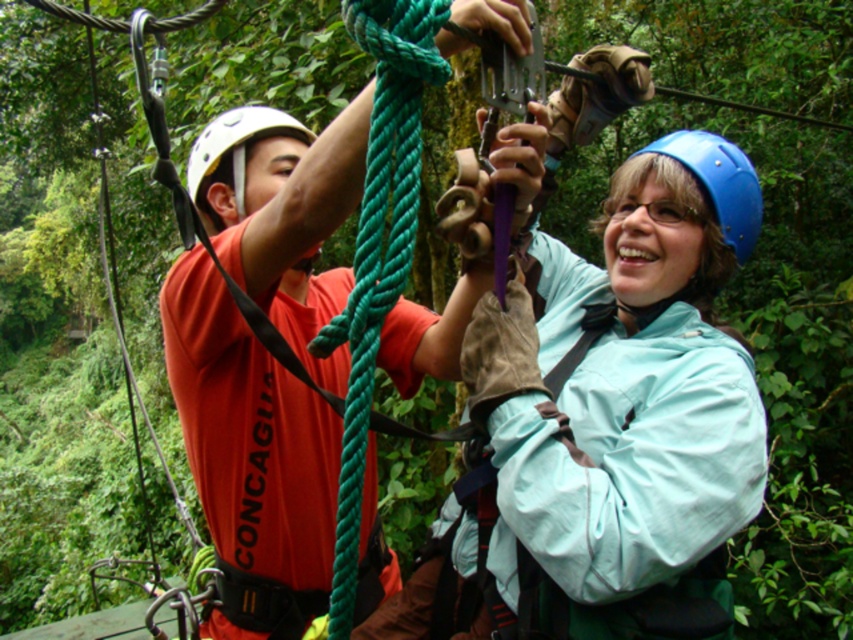
You are a safety inspector observing the ropes course activity. You notice two helmets in the scene. Which helmet, the blue matte helmet at center or the white matte helmet at upper left, is positioned closer to you?

The blue matte helmet at center is closer to the viewer than the white matte helmet at upper left.

You are a safety inspector checking the equipment of two participants in a ropes course. You notice the blue matte helmet at center and the white matte helmet at upper left. According to safety regulations, helmets must be of uniform size to ensure proper fit. Do the helmets meet this requirement?

The blue matte helmet at center is bigger than the white matte helmet at upper left, so they are not of uniform size and do not meet the safety requirement.